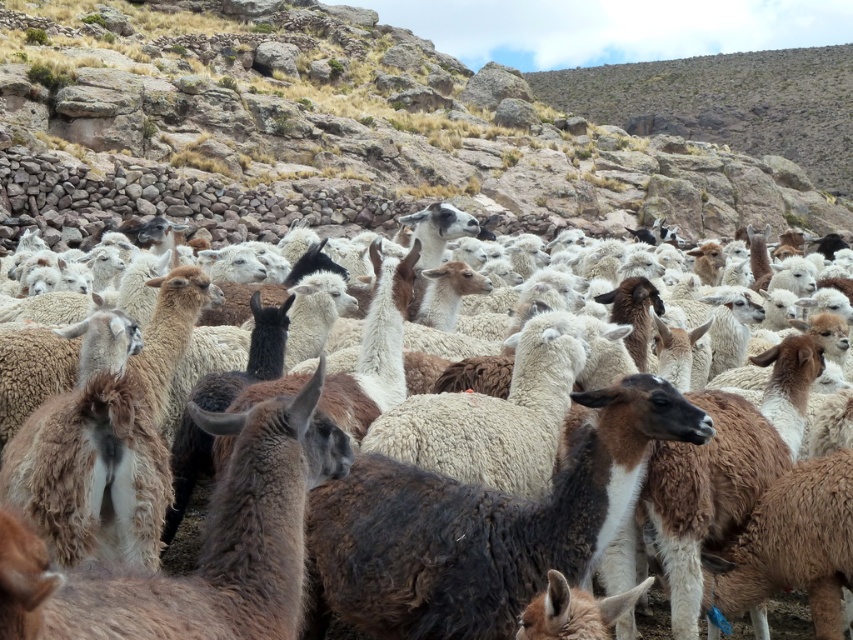
Question: Which object is farther from the camera taking this photo?

Choices:
 (A) fuzzy white sheep at center
 (B) brown woolen alpacas at center

Answer: (B)

Question: Does brown woolen alpacas at center have a greater width compared to fuzzy white sheep at center?

Choices:
 (A) yes
 (B) no

Answer: (A)

Question: Can you confirm if brown woolen alpacas at center is smaller than fuzzy white sheep at center?

Choices:
 (A) no
 (B) yes

Answer: (A)

Question: Is brown woolen alpacas at center positioned at the back of fuzzy white sheep at center?

Choices:
 (A) no
 (B) yes

Answer: (B)

Question: Which point is farther from the camera taking this photo?

Choices:
 (A) (849, 177)
 (B) (222, 413)

Answer: (A)